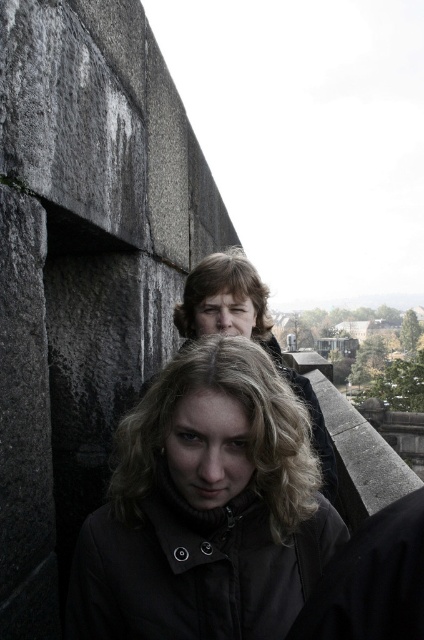
Consider the image. Between matte black jacket at center and blonde curly hair at upper center, which one appears on the right side from the viewer's perspective?

From the viewer's perspective, matte black jacket at center appears more on the right side.

Between point (198, 380) and point (189, 278), which one is positioned in front?

Positioned in front is point (198, 380).

You are a GUI agent. You are given a task and a screenshot of the screen. Output one action in this format:
    pyautogui.click(x=<x>, y=<y>)
    Task: Click on the matte black jacket at center
    
    Given the screenshot: What is the action you would take?
    pyautogui.click(x=206, y=508)

Where is `matte black jacket at center`? The image size is (424, 640). matte black jacket at center is located at coordinates (206, 508).

Is matte black jacket at center to the left of matte black jacket at upper center from the viewer's perspective?

Correct, you'll find matte black jacket at center to the left of matte black jacket at upper center.

Measure the distance from matte black jacket at center to matte black jacket at upper center.

matte black jacket at center and matte black jacket at upper center are 1.62 meters apart.

At what (x,y) coordinates should I click in order to perform the action: click on matte black jacket at center. Please return your answer as a coordinate pair (x, y). Looking at the image, I should click on (206, 508).

Does matte black jacket at upper center appear on the left side of blonde curly hair at upper center?

In fact, matte black jacket at upper center is to the right of blonde curly hair at upper center.

The image size is (424, 640). Find the location of `matte black jacket at upper center`. matte black jacket at upper center is located at coordinates (247, 332).